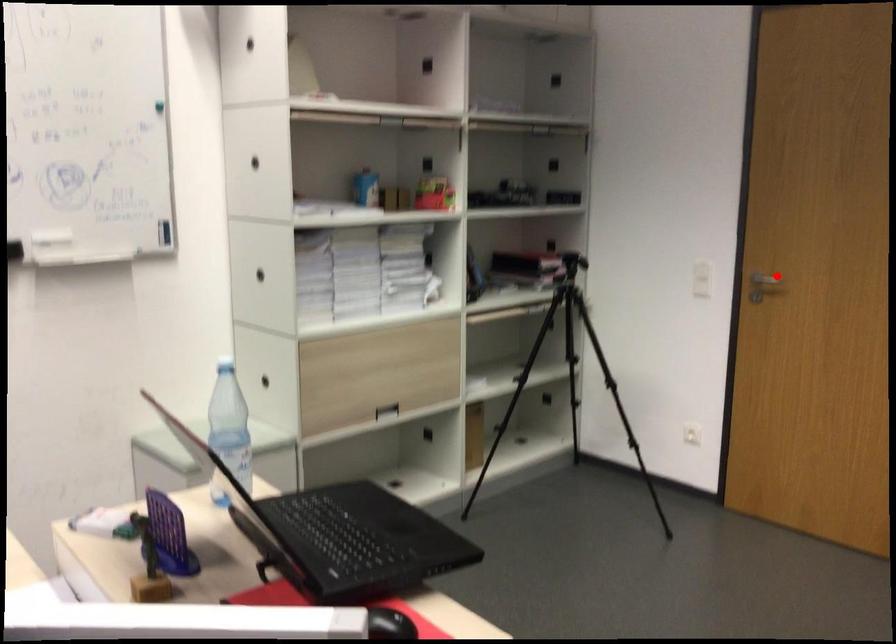
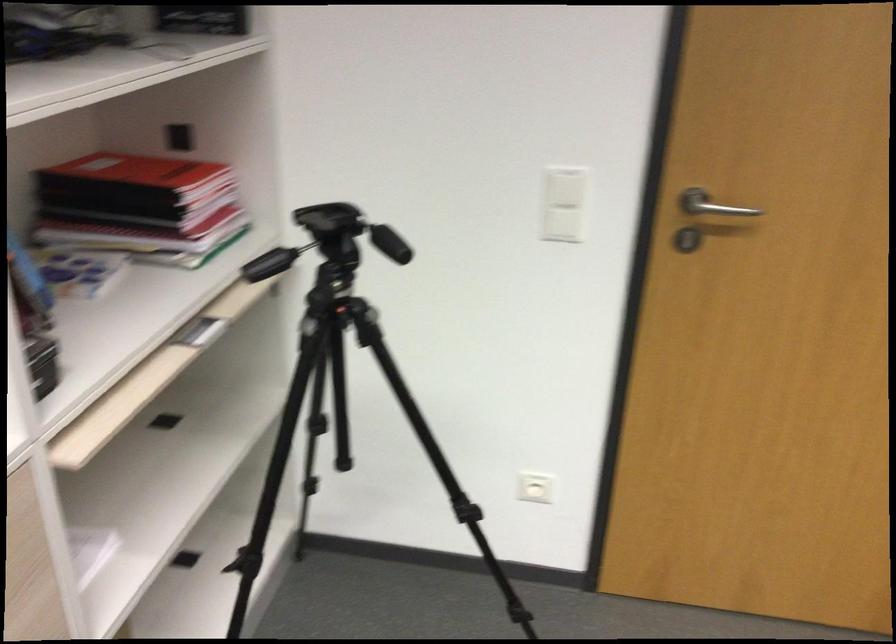
Locate, in the second image, the point that corresponds to the highlighted location in the first image.

(711, 205)